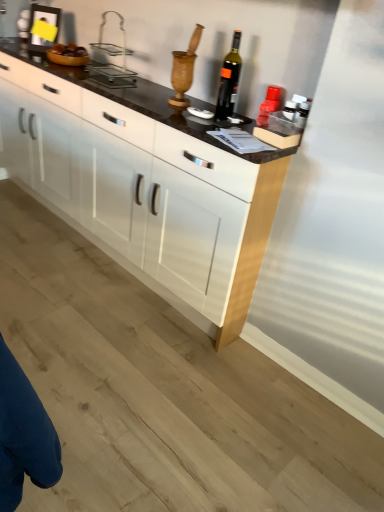
Locate an element on the screen. The image size is (384, 512). clear plastic basket at upper center is located at coordinates (111, 63).

Consider the image. Is dark glass bottle at center directly adjacent to clear plastic basket at upper center?

No, dark glass bottle at center is not touching clear plastic basket at upper center.

How different are the orientations of dark glass bottle at center and clear plastic basket at upper center in degrees?

0.105 degrees separate the facing orientations of dark glass bottle at center and clear plastic basket at upper center.

Between dark glass bottle at center and clear plastic basket at upper center, which one has larger width?

With larger width is clear plastic basket at upper center.

Is dark glass bottle at center inside or outside of clear plastic basket at upper center?

dark glass bottle at center is located beyond the bounds of clear plastic basket at upper center.

Which is less distant, (104, 18) or (229, 86)?

The point (229, 86) is in front.

Is clear plastic basket at upper center oriented towards dark glass bottle at center?

No, clear plastic basket at upper center is not facing towards dark glass bottle at center.

Is clear plastic basket at upper center touching dark glass bottle at center?

They are not placed beside each other.

Does clear plastic basket at upper center have a larger size compared to dark glass bottle at center?

Indeed, clear plastic basket at upper center has a larger size compared to dark glass bottle at center.

Can you confirm if dark glass bottle at center is positioned to the right of white glossy cabinet at center?

Yes.

From the image's perspective, would you say dark glass bottle at center is shown under white glossy cabinet at center?

No, from the image's perspective, dark glass bottle at center is not beneath white glossy cabinet at center.

From a real-world perspective, which object stands above the other?

From a 3D spatial view, dark glass bottle at center is above.

Is dark glass bottle at center inside the boundaries of white glossy cabinet at center, or outside?

dark glass bottle at center cannot be found inside white glossy cabinet at center.

Considering the relative positions of clear plastic basket at upper center and white glossy cabinet at center in the image provided, is clear plastic basket at upper center to the left or to the right of white glossy cabinet at center?

Based on their positions, clear plastic basket at upper center is located to the right of white glossy cabinet at center.

From the image's perspective, which one is positioned lower, clear plastic basket at upper center or white glossy cabinet at center?

white glossy cabinet at center, from the image's perspective.

Locate an element on the screen. appliance lying above the white glossy cabinet at center (from the image's perspective) is located at coordinates 111,63.

Would you say dark glass bottle at center is part of white glossy cabinet at center's contents?

No, dark glass bottle at center is not surrounded by white glossy cabinet at center.

The image size is (384, 512). What are the coordinates of `cabinetry that appears in front of the dark glass bottle at center` in the screenshot? It's located at (145, 183).

Is white glossy cabinet at center in contact with dark glass bottle at center?

There is a gap between white glossy cabinet at center and dark glass bottle at center.

From a real-world perspective, is white glossy cabinet at center on top of dark glass bottle at center?

Incorrect, from a real-world perspective, white glossy cabinet at center is lower than dark glass bottle at center.

Considering the relative sizes of white glossy cabinet at center and clear plastic basket at upper center in the image provided, is white glossy cabinet at center taller than clear plastic basket at upper center?

Correct, white glossy cabinet at center is much taller as clear plastic basket at upper center.

Is white glossy cabinet at center not close to clear plastic basket at upper center?

That's not correct — white glossy cabinet at center is a little close to clear plastic basket at upper center.

From the picture: From a real-world perspective, who is located lower, white glossy cabinet at center or clear plastic basket at upper center?

white glossy cabinet at center, from a real-world perspective.

From the image's perspective, relative to clear plastic basket at upper center, is white glossy cabinet at center above or below?

Based on their image positions, white glossy cabinet at center is located beneath clear plastic basket at upper center.

Locate an element on the screen. appliance on the left of dark glass bottle at center is located at coordinates (111, 63).

In the image, there is a clear plastic basket at upper center. Identify the location of wine bottle below it (from the image's perspective). (229, 80).

Based on their spatial positions, is dark glass bottle at center or white glossy cabinet at center closer to clear plastic basket at upper center?

white glossy cabinet at center is positioned closer to the anchor clear plastic basket at upper center.

From the image, which object appears to be farther from white glossy cabinet at center, clear plastic basket at upper center or dark glass bottle at center?

dark glass bottle at center is further to white glossy cabinet at center.

Estimate the real-world distances between objects in this image. Which object is further from dark glass bottle at center, white glossy cabinet at center or clear plastic basket at upper center?

white glossy cabinet at center.

Considering their positions, is white glossy cabinet at center positioned further to clear plastic basket at upper center than dark glass bottle at center?

Based on the image, dark glass bottle at center appears to be further to clear plastic basket at upper center.

Looking at the image, which one is located closer to white glossy cabinet at center, dark glass bottle at center or clear plastic basket at upper center?

clear plastic basket at upper center is closer to white glossy cabinet at center.

When comparing their distances from dark glass bottle at center, does clear plastic basket at upper center or white glossy cabinet at center seem closer?

The object closer to dark glass bottle at center is clear plastic basket at upper center.

This screenshot has height=512, width=384. In order to click on appliance between white glossy cabinet at center and dark glass bottle at center in this screenshot , I will do `click(111, 63)`.